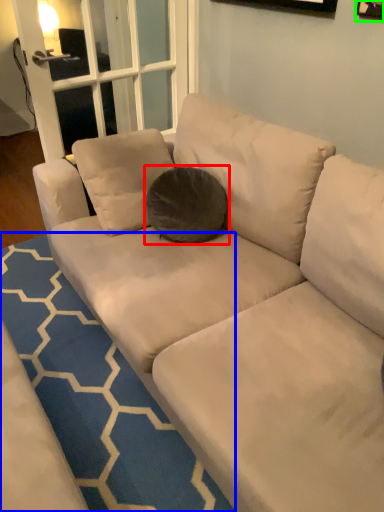
Question: Which is nearer to the throw pillow (highlighted by a red box)? doormat (highlighted by a blue box) or picture frame (highlighted by a green box).

Choices:
 (A) doormat
 (B) picture frame

Answer: (A)